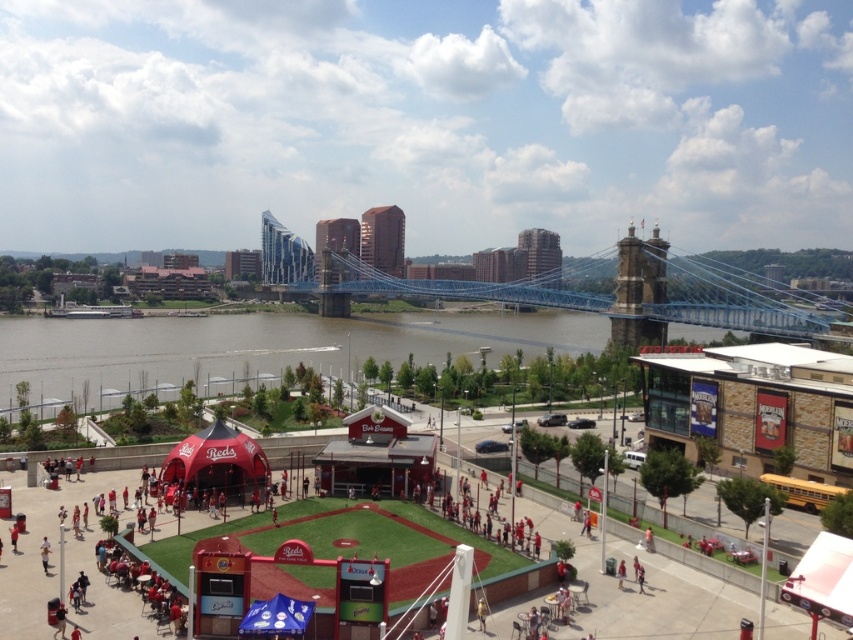
How far apart are red fabric tent at center and blue metallic suspension bridge at center?

The distance of red fabric tent at center from blue metallic suspension bridge at center is 43.98 meters.

Image resolution: width=853 pixels, height=640 pixels. What do you see at coordinates (257, 346) in the screenshot?
I see `red fabric tent at center` at bounding box center [257, 346].

Locate an element on the screen. red fabric tent at center is located at coordinates (257, 346).